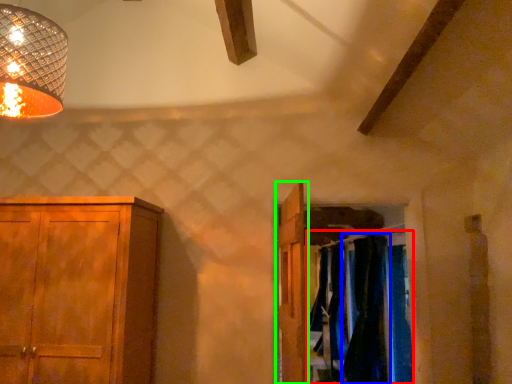
Question: Considering the real-world distances, which object is closest to laundry (highlighted by a red box)? curtain (highlighted by a blue box) or door (highlighted by a green box).

Choices:
 (A) curtain
 (B) door

Answer: (A)